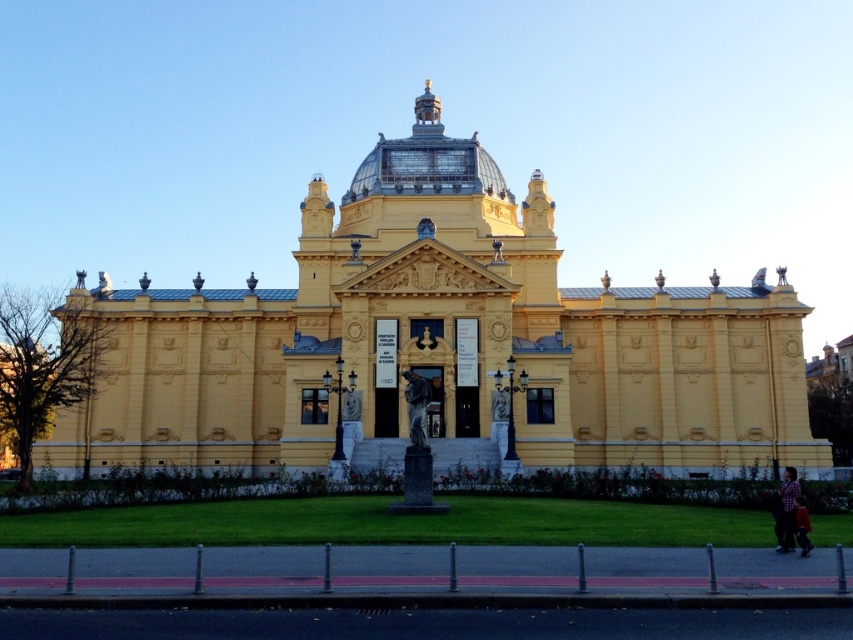
Looking at this image, does yellow stone church at center have a smaller size compared to dark brown leather jacket at lower right?

No.

Does yellow stone church at center appear on the left side of dark brown leather jacket at lower right?

Correct, you'll find yellow stone church at center to the left of dark brown leather jacket at lower right.

Which is in front, point (199, 292) or point (804, 509)?

Point (804, 509)

Where is `yellow stone church at center`? Image resolution: width=853 pixels, height=640 pixels. yellow stone church at center is located at coordinates [440, 344].

Is bronze statue at center closer to camera compared to dark brown leather jacket at lower right?

No, it is behind dark brown leather jacket at lower right.

Between bronze statue at center and dark brown leather jacket at lower right, which one has less height?

With less height is dark brown leather jacket at lower right.

Which is in front, point (416, 381) or point (799, 552)?

Positioned in front is point (799, 552).

Locate an element on the screen. bronze statue at center is located at coordinates (416, 406).

Where is `yellow stone church at center`? This screenshot has height=640, width=853. yellow stone church at center is located at coordinates pos(440,344).

Is point (607, 417) positioned behind point (787, 500)?

Yes.

Is point (531, 337) positioned behind point (782, 477)?

No, it is not.

The width and height of the screenshot is (853, 640). Identify the location of yellow stone church at center. (440, 344).